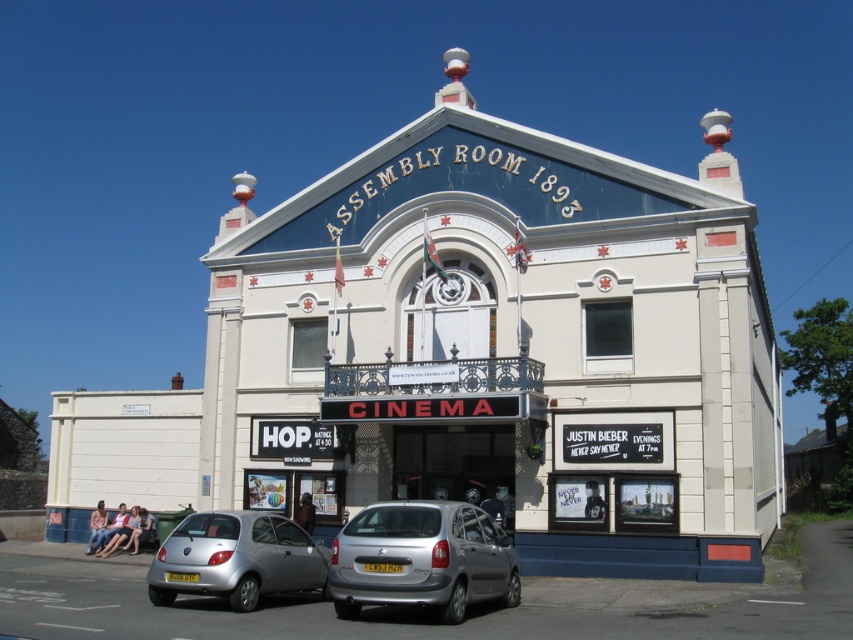
Between silver metallic hatchback at lower center and silver metallic car at lower left, which one appears on the left side from the viewer's perspective?

silver metallic car at lower left

Who is more distant from viewer, (381, 570) or (235, 579)?

Positioned behind is point (235, 579).

Where is `silver metallic hatchback at lower center`? silver metallic hatchback at lower center is located at coordinates (422, 557).